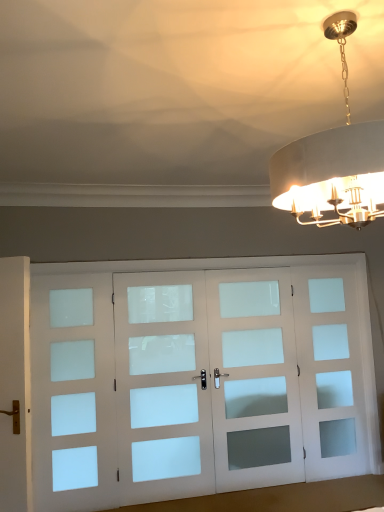
Question: From a real-world perspective, is white frosted glass screen door at center, the 3th screen door from the left, below metallic gold chandelier at upper right?

Choices:
 (A) yes
 (B) no

Answer: (A)

Question: Can you confirm if white frosted glass screen door at center, arranged as the 2th screen door when viewed from the right, is smaller than metallic gold chandelier at upper right?

Choices:
 (A) no
 (B) yes

Answer: (B)

Question: Does white frosted glass screen door at center, the 3th screen door from the left, appear on the right side of metallic gold chandelier at upper right?

Choices:
 (A) yes
 (B) no

Answer: (A)

Question: Is white frosted glass screen door at center, arranged as the 2th screen door when viewed from the right, facing towards metallic gold chandelier at upper right?

Choices:
 (A) no
 (B) yes

Answer: (B)

Question: From a real-world perspective, is white frosted glass screen door at center, the 3th screen door from the left, over metallic gold chandelier at upper right?

Choices:
 (A) no
 (B) yes

Answer: (A)

Question: Can you confirm if white frosted glass screen door at center, arranged as the 2th screen door when viewed from the right, is positioned to the left of metallic gold chandelier at upper right?

Choices:
 (A) no
 (B) yes

Answer: (A)

Question: Is white frosted glass screen door at center, arranged as the 2th screen door when viewed from the right, a part of white frosted glass door at center, acting as the second screen door starting from the left?

Choices:
 (A) no
 (B) yes

Answer: (A)

Question: Is white frosted glass door at center, acting as the second screen door starting from the left, touching white frosted glass screen door at center, the 3th screen door from the left?

Choices:
 (A) yes
 (B) no

Answer: (B)

Question: Can you confirm if white frosted glass door at center, acting as the second screen door starting from the left, is shorter than white frosted glass screen door at center, arranged as the 2th screen door when viewed from the right?

Choices:
 (A) no
 (B) yes

Answer: (A)

Question: From the image's perspective, is white frosted glass door at center, acting as the second screen door starting from the left, under white frosted glass screen door at center, arranged as the 2th screen door when viewed from the right?

Choices:
 (A) yes
 (B) no

Answer: (A)

Question: From a real-world perspective, is white frosted glass door at center, which is the third screen door from right to left, physically above white frosted glass screen door at center, arranged as the 2th screen door when viewed from the right?

Choices:
 (A) yes
 (B) no

Answer: (B)

Question: Is white frosted glass door at center, which is the third screen door from right to left, to the right of white frosted glass screen door at center, the 3th screen door from the left, from the viewer's perspective?

Choices:
 (A) no
 (B) yes

Answer: (A)

Question: Does white frosted glass screen door at left, marked as the 4th screen door in a right-to-left arrangement, have a greater width compared to white frosted glass screen door at right, the fourth screen door when ordered from left to right?

Choices:
 (A) no
 (B) yes

Answer: (A)